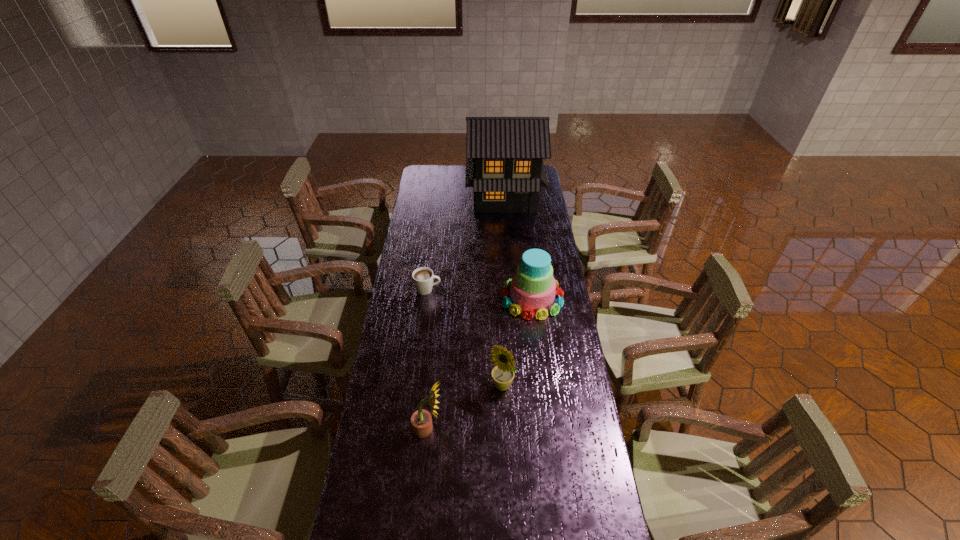
This screenshot has height=540, width=960. Identify the location of the tallest object. (504, 155).

Where is `the farthest object`? The width and height of the screenshot is (960, 540). the farthest object is located at coordinates (504, 155).

I want to click on cake, so click(532, 288).

Find the location of `the nearer sunflower`. the nearer sunflower is located at coordinates (421, 420).

I want to click on the left sunflower, so click(421, 420).

Identify the location of the second nearest object. This screenshot has height=540, width=960. (503, 374).

The width and height of the screenshot is (960, 540). What are the coordinates of `the right sunflower` in the screenshot? It's located at (503, 374).

Find the location of a particular element. the shortest object is located at coordinates (423, 277).

At what (x,y) coordinates should I click in order to perform the action: click on free spot located on the front-facing side of the farthest object. Please return your answer as a coordinate pair (x, y). This screenshot has width=960, height=540. Looking at the image, I should click on (509, 249).

Where is `vacant space located on the back of the cake`? vacant space located on the back of the cake is located at coordinates (526, 246).